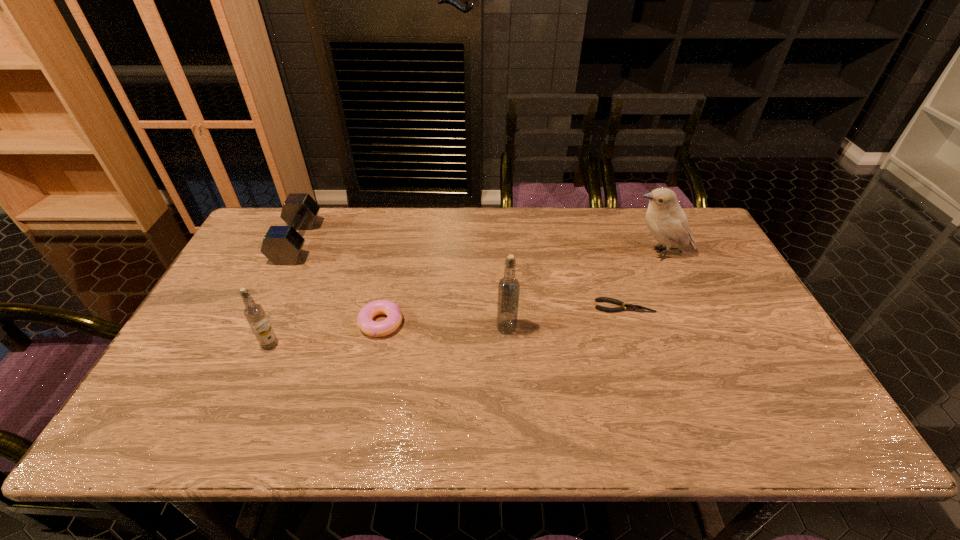
In order to click on the left vodka in this screenshot , I will do `click(254, 313)`.

I want to click on the nearer vodka, so click(x=254, y=313).

At what (x,y) coordinates should I click in order to perform the action: click on the farther vodka. Please return your answer as a coordinate pair (x, y). Image resolution: width=960 pixels, height=540 pixels. Looking at the image, I should click on (508, 287).

Identify the location of the taller vodka. Image resolution: width=960 pixels, height=540 pixels. (508, 287).

This screenshot has width=960, height=540. Find the location of `dumbbell`. dumbbell is located at coordinates (282, 245).

This screenshot has width=960, height=540. Identify the location of doughnut. (394, 314).

Where is `the fifth tallest object`? This screenshot has width=960, height=540. the fifth tallest object is located at coordinates (394, 314).

The width and height of the screenshot is (960, 540). I want to click on bird, so click(x=666, y=220).

Where is `the shortest object`? This screenshot has height=540, width=960. the shortest object is located at coordinates (630, 307).

The image size is (960, 540). Identify the location of vacant space located on the label of the shorter vodka. (246, 400).